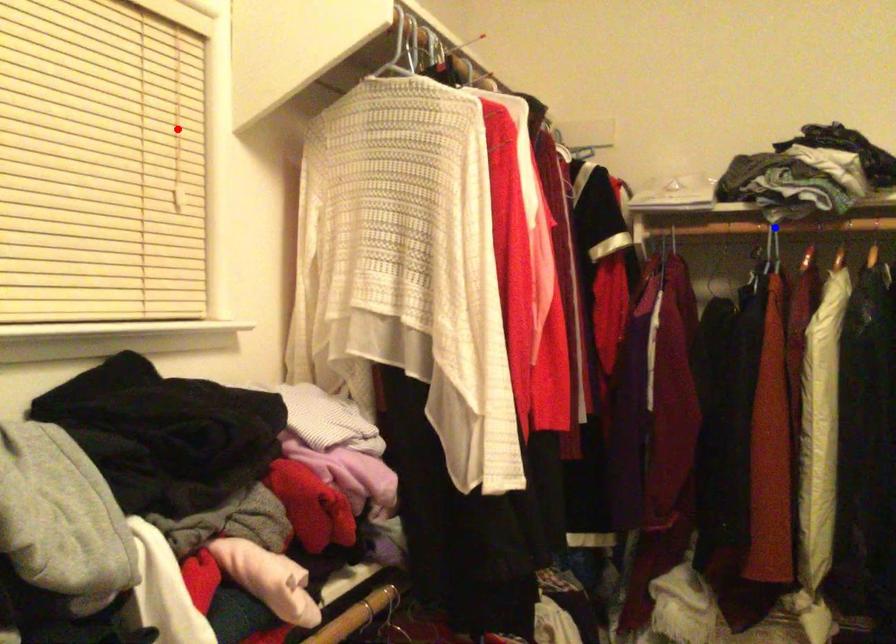
Question: Which of the two points in the image is closer to the camera?

Choices:
 (A) Blue point is closer.
 (B) Red point is closer.

Answer: (B)